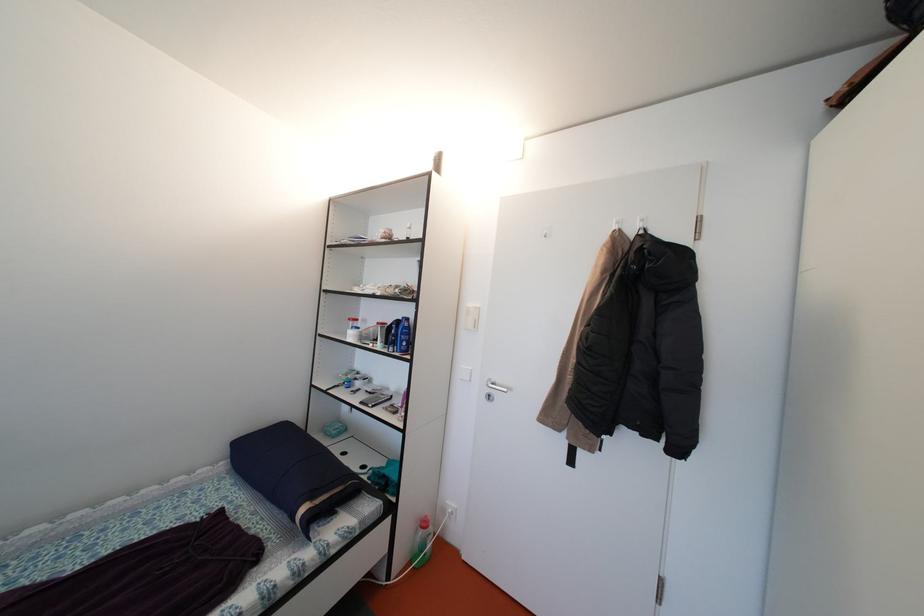
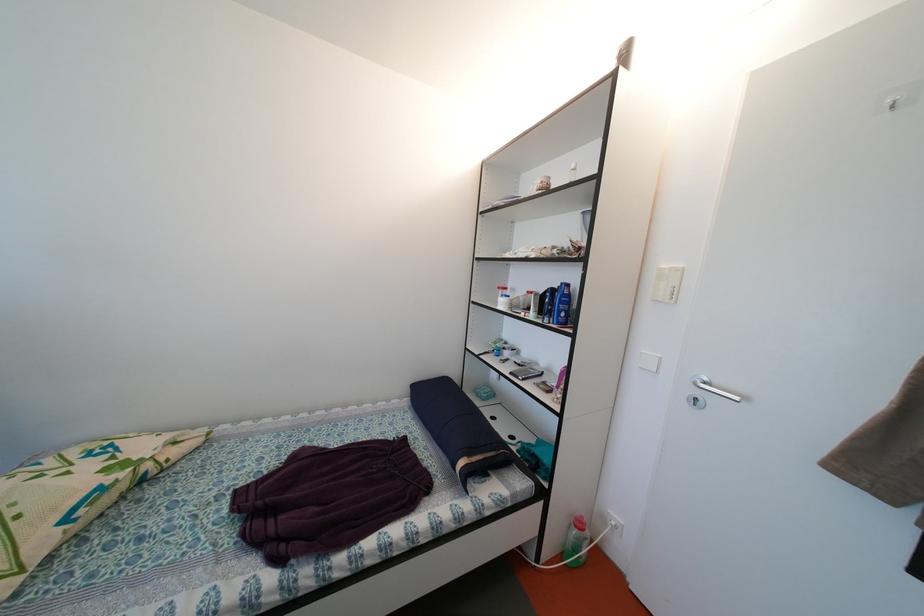
Find the pixel in the second image that matches [473,326] in the first image.

(662, 294)